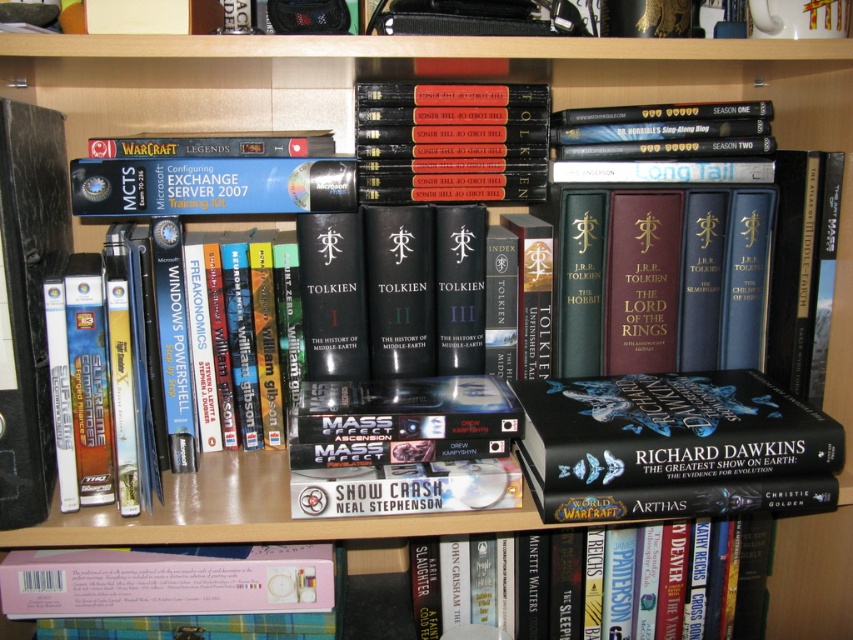
Which is behind, point (3, 588) or point (747, 579)?

Point (747, 579)

Based on the photo, can you confirm if pink matte book at lower left is wider than hardcover book at center?

Yes.

What do you see at coordinates (167, 580) in the screenshot? The width and height of the screenshot is (853, 640). I see `pink matte book at lower left` at bounding box center [167, 580].

Find the location of a particular element. pink matte book at lower left is located at coordinates (167, 580).